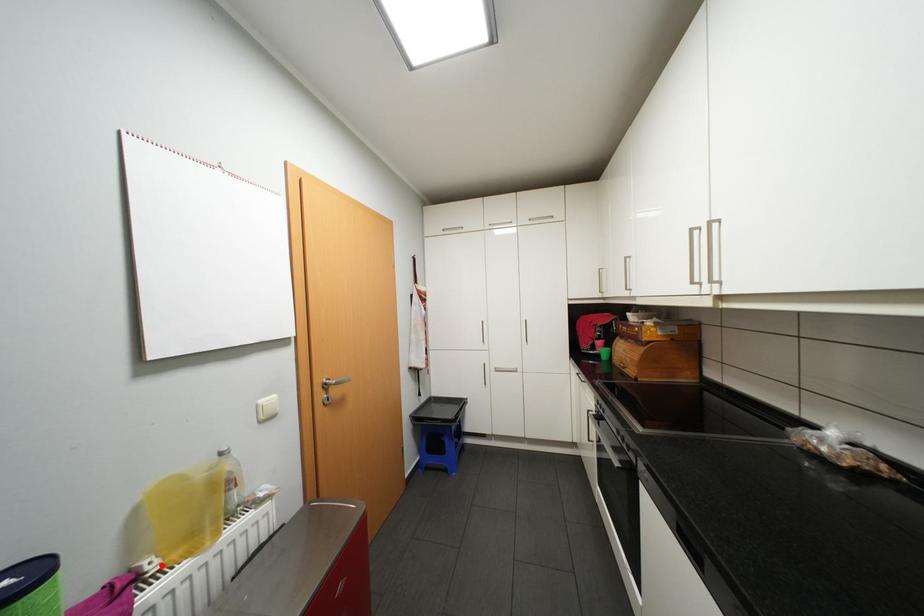
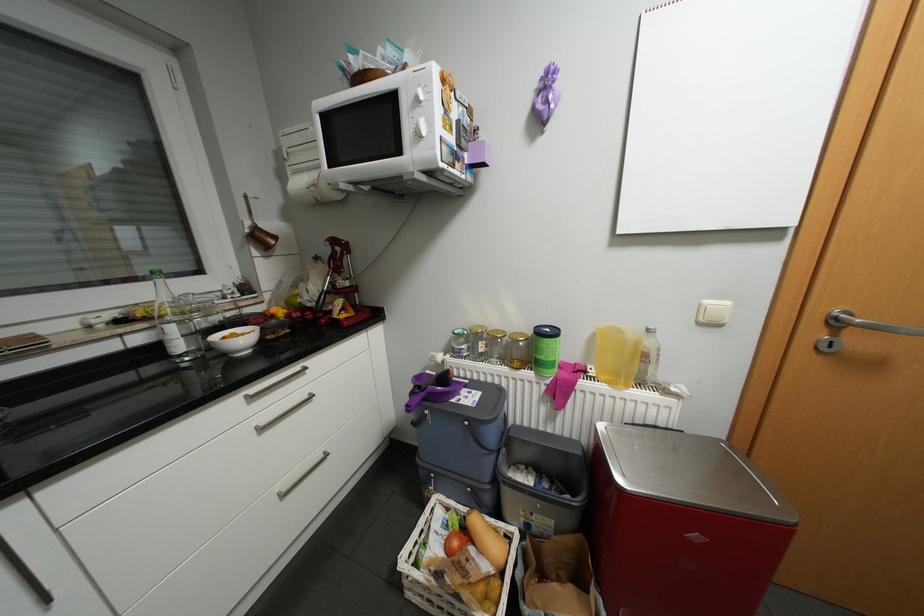
Locate, in the second image, the point that corresponds to the highlighted location in the first image.

(600, 371)